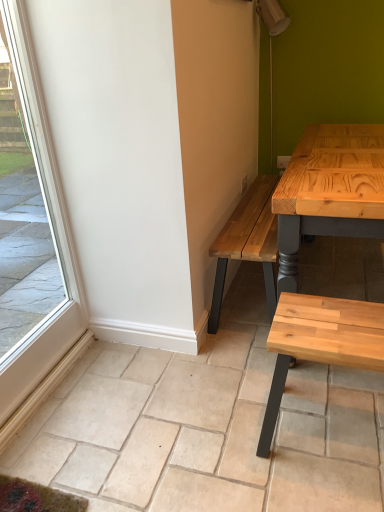
Question: From a real-world perspective, is natural wood bench at lower right above or below clear glass window at left?

Choices:
 (A) below
 (B) above

Answer: (A)

Question: Is natural wood bench at lower right to the left or to the right of clear glass window at left in the image?

Choices:
 (A) left
 (B) right

Answer: (B)

Question: Which object is positioned closest to the natural stone tile at lower center?

Choices:
 (A) clear glass window at left
 (B) natural wood bench at lower right

Answer: (B)

Question: Considering the real-world distances, which object is farthest from the natural wood bench at lower right?

Choices:
 (A) natural stone tile at lower center
 (B) clear glass window at left

Answer: (B)